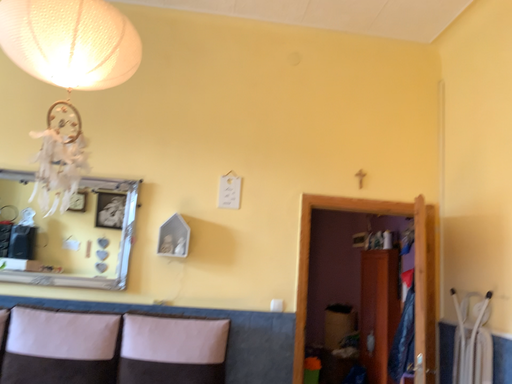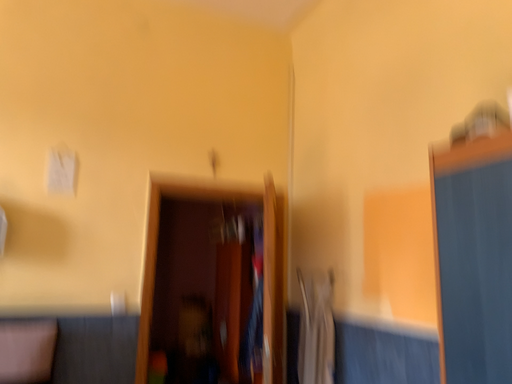
Question: How did the camera likely rotate when shooting the video?

Choices:
 (A) rotated left
 (B) rotated right

Answer: (B)